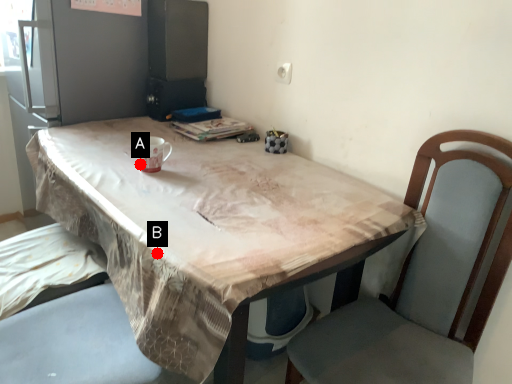
Question: Two points are circled on the image, labeled by A and B beside each circle. Which point appears closest to the camera in this image?

Choices:
 (A) A is closer
 (B) B is closer

Answer: (B)